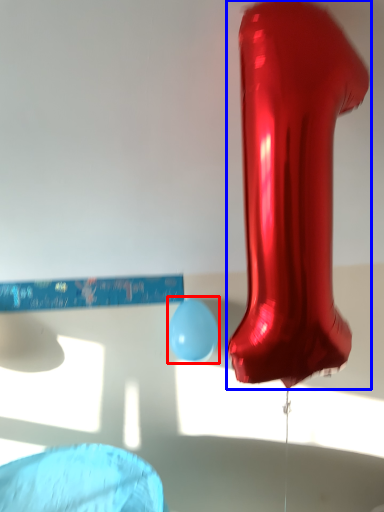
Question: Which point is closer to the camera, balloon (highlighted by a red box) or footwear (highlighted by a blue box)?

Choices:
 (A) balloon
 (B) footwear

Answer: (B)